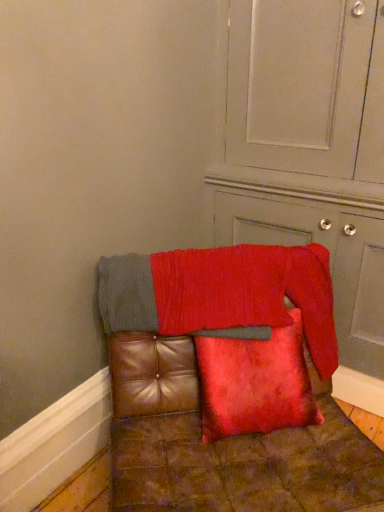
Measure the distance between velvet red pillow at center and camera.

They are 1.30 meters apart.

Looking at this image, measure the distance between point (345, 64) and camera.

Point (345, 64) is 4.87 feet from camera.

The height and width of the screenshot is (512, 384). I want to click on velvet red cushion at lower right, so click(310, 149).

Find the location of a particular element. The height and width of the screenshot is (512, 384). red textured blanket at center is located at coordinates (222, 294).

Looking at this image, which is in front, red textured blanket at center or leather cushion at center?

leather cushion at center is more forward.

Is leather cushion at center at the back of red textured blanket at center?

Yes, red textured blanket at center is positioned with its back facing leather cushion at center.

Locate an element on the screen. blanket that is behind the leather cushion at center is located at coordinates (222, 294).

From the image's perspective, is velvet red pillow at center above or below red textured blanket at center?

Clearly, from the image's perspective, velvet red pillow at center is below red textured blanket at center.

Can you see velvet red pillow at center touching red textured blanket at center?

No, velvet red pillow at center is not touching red textured blanket at center.

Looking at this image, does velvet red pillow at center have a greater width compared to red textured blanket at center?

Incorrect, the width of velvet red pillow at center does not surpass that of red textured blanket at center.

Which object is more forward, velvet red pillow at center or red textured blanket at center?

Positioned in front is velvet red pillow at center.

Can you confirm if velvet red pillow at center is taller than velvet red cushion at lower right?

No, velvet red pillow at center is not taller than velvet red cushion at lower right.

Can you confirm if velvet red pillow at center is thinner than velvet red cushion at lower right?

Correct, the width of velvet red pillow at center is less than that of velvet red cushion at lower right.

Is velvet red pillow at center located outside velvet red cushion at lower right?

Yes, velvet red pillow at center is outside of velvet red cushion at lower right.

At what (x,y) coordinates should I click in order to perform the action: click on dresser located above the velvet red pillow at center (from a real-world perspective). Please return your answer as a coordinate pair (x, y). Looking at the image, I should click on (310, 149).

Does leather cushion at center have a greater height compared to red textured blanket at center?

Yes.

How much distance is there between leather cushion at center and red textured blanket at center?

leather cushion at center and red textured blanket at center are 4.60 inches apart.

Is leather cushion at center further to the viewer compared to red textured blanket at center?

No, leather cushion at center is in front of red textured blanket at center.

Which is more to the right, leather cushion at center or red textured blanket at center?

From the viewer's perspective, leather cushion at center appears more on the right side.

Based on the photo, is red textured blanket at center placed right next to velvet red pillow at center?

No, red textured blanket at center is not in contact with velvet red pillow at center.

Between point (151, 319) and point (217, 364), which one is positioned in front?

Positioned in front is point (217, 364).

Is red textured blanket at center at the right side of velvet red pillow at center?

No.

Identify the location of dresser on the right of velvet red pillow at center. This screenshot has width=384, height=512. (310, 149).

Is velvet red cushion at lower right not near velvet red pillow at center?

No, velvet red cushion at lower right is not far away from velvet red pillow at center.

Is velvet red cushion at lower right in front of or behind velvet red pillow at center in the image?

Clearly, velvet red cushion at lower right is in front of velvet red pillow at center.

Does leather cushion at center turn towards velvet red pillow at center?

Yes, leather cushion at center is turned towards velvet red pillow at center.

Can you confirm if leather cushion at center is positioned to the right of velvet red pillow at center?

No, leather cushion at center is not to the right of velvet red pillow at center.

Is leather cushion at center not within velvet red pillow at center?

That's correct, leather cushion at center is outside of velvet red pillow at center.

Image resolution: width=384 pixels, height=512 pixels. What are the coordinates of `furniture in front of the red textured blanket at center` in the screenshot? It's located at (229, 385).

This screenshot has height=512, width=384. In the image, there is a red textured blanket at center. Identify the location of pillow below it (from a real-world perspective). (255, 383).

Which object lies further to the anchor point leather cushion at center, velvet red pillow at center or velvet red cushion at lower right?

Among the two, velvet red cushion at lower right is located further to leather cushion at center.

Considering their positions, is velvet red pillow at center positioned closer to velvet red cushion at lower right than red textured blanket at center?

red textured blanket at center.

From the image, which object appears to be farther from velvet red pillow at center, leather cushion at center or red textured blanket at center?

Based on the image, red textured blanket at center appears to be further to velvet red pillow at center.

Based on their spatial positions, is velvet red pillow at center or velvet red cushion at lower right further from red textured blanket at center?

The object further to red textured blanket at center is velvet red cushion at lower right.

Estimate the real-world distances between objects in this image. Which object is further from red textured blanket at center, leather cushion at center or velvet red pillow at center?

velvet red pillow at center is positioned further to the anchor red textured blanket at center.

Estimate the real-world distances between objects in this image. Which object is further from leather cushion at center, red textured blanket at center or velvet red pillow at center?

Based on the image, red textured blanket at center appears to be further to leather cushion at center.

From the image, which object appears to be nearer to velvet red pillow at center, red textured blanket at center or velvet red cushion at lower right?

red textured blanket at center lies closer to velvet red pillow at center than the other object.

Which object lies further to the anchor point velvet red cushion at lower right, red textured blanket at center or velvet red pillow at center?

Based on the image, velvet red pillow at center appears to be further to velvet red cushion at lower right.

In order to click on blanket between velvet red cushion at lower right and velvet red pillow at center in the up-down direction in this screenshot , I will do `click(222, 294)`.

Identify the location of pillow between velvet red cushion at lower right and leather cushion at center in the up-down direction. The image size is (384, 512). (255, 383).

The height and width of the screenshot is (512, 384). Find the location of `pillow positioned between leather cushion at center and red textured blanket at center from near to far`. pillow positioned between leather cushion at center and red textured blanket at center from near to far is located at coordinates (255, 383).

Where is `blanket between velvet red cushion at lower right and leather cushion at center in the up-down direction`? blanket between velvet red cushion at lower right and leather cushion at center in the up-down direction is located at coordinates (222, 294).